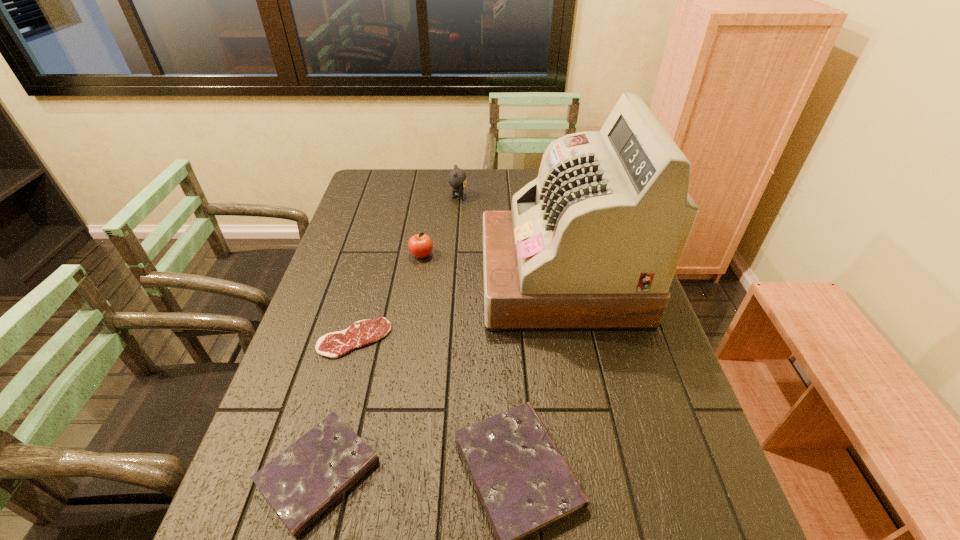
This screenshot has height=540, width=960. I want to click on the fourth shortest object, so click(420, 245).

The width and height of the screenshot is (960, 540). I want to click on kitten, so click(x=457, y=178).

At what (x,y) coordinates should I click in order to perform the action: click on the farthest object. Please return your answer as a coordinate pair (x, y). The width and height of the screenshot is (960, 540). Looking at the image, I should click on tap(457, 178).

Where is `the tallest object`? the tallest object is located at coordinates (593, 243).

I want to click on steak, so click(333, 345).

This screenshot has height=540, width=960. I want to click on blank space located on the front of the apple, so click(x=419, y=274).

At what (x,y) coordinates should I click in order to perform the action: click on free region located on the front-facing side of the kitten. Please return your answer as a coordinate pair (x, y). Looking at the image, I should click on (514, 198).

The image size is (960, 540). I want to click on vacant space located 0.340m on the operating side of the tallest object, so click(x=367, y=281).

Identify the location of vacant position located on the operating side of the tallest object. This screenshot has height=540, width=960. (415, 281).

Locate an element on the screen. The height and width of the screenshot is (540, 960). vacant point located 0.080m on the operating side of the tallest object is located at coordinates (456, 281).